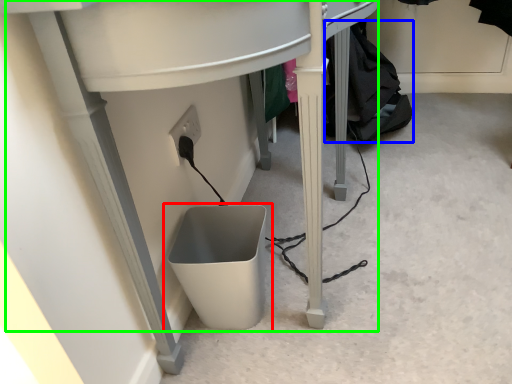
Question: Considering the real-world distances, which object is farthest from waste container (highlighted by a red box)? clothing (highlighted by a blue box) or computer desk (highlighted by a green box)?

Choices:
 (A) clothing
 (B) computer desk

Answer: (A)